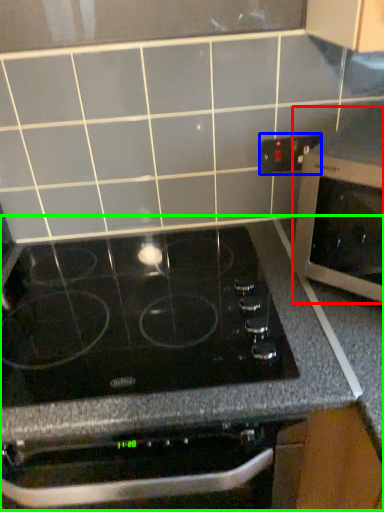
Question: Based on their relative distances, which object is farther from microwave oven (highlighted by a red box)? Choose from electric outlet (highlighted by a blue box) and counter (highlighted by a green box).

Choices:
 (A) electric outlet
 (B) counter

Answer: (A)